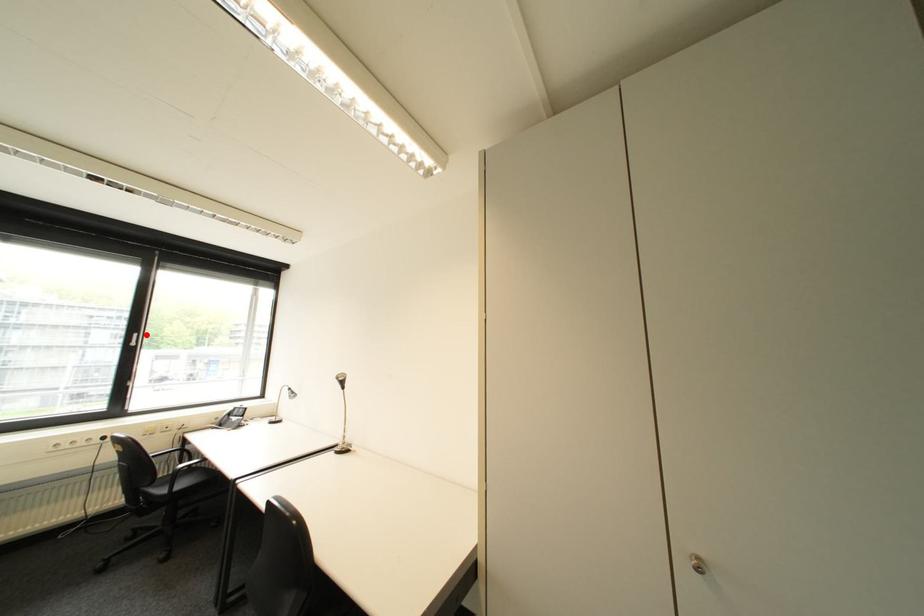
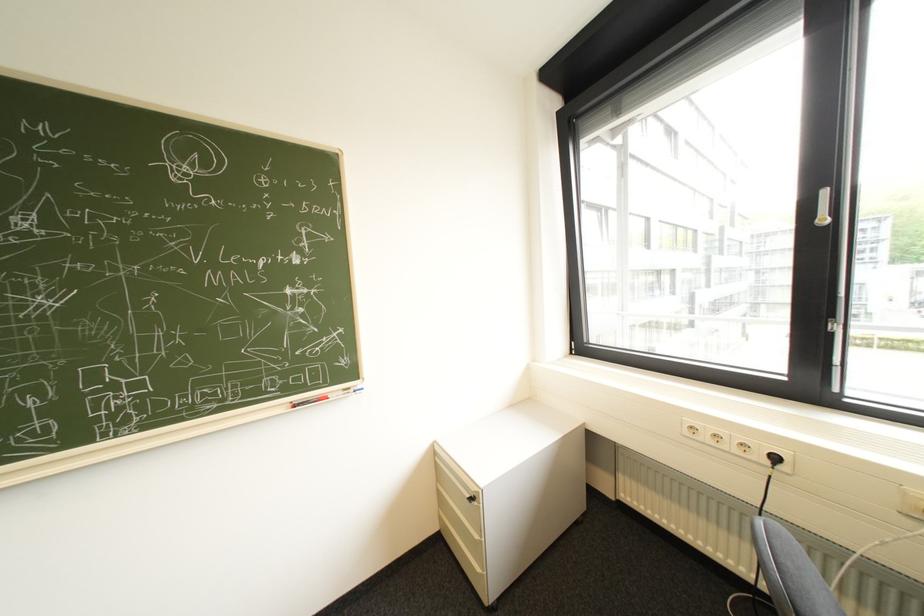
In the second image, find the point that corresponds to the highlighted location in the first image.

(834, 193)